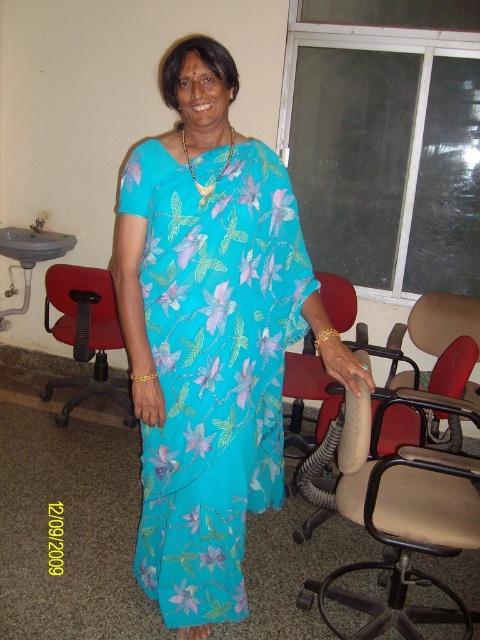
Question: Can you confirm if turquoise floral fabric dress at center is positioned to the right of matte red chair at left?

Choices:
 (A) yes
 (B) no

Answer: (A)

Question: Among these objects, which one is nearest to the camera?

Choices:
 (A) matte red chair at left
 (B) turquoise floral fabric dress at center

Answer: (B)

Question: Can you confirm if turquoise floral fabric dress at center is positioned to the left of matte red chair at left?

Choices:
 (A) no
 (B) yes

Answer: (A)

Question: Does turquoise floral fabric dress at center have a smaller size compared to matte red chair at left?

Choices:
 (A) no
 (B) yes

Answer: (B)